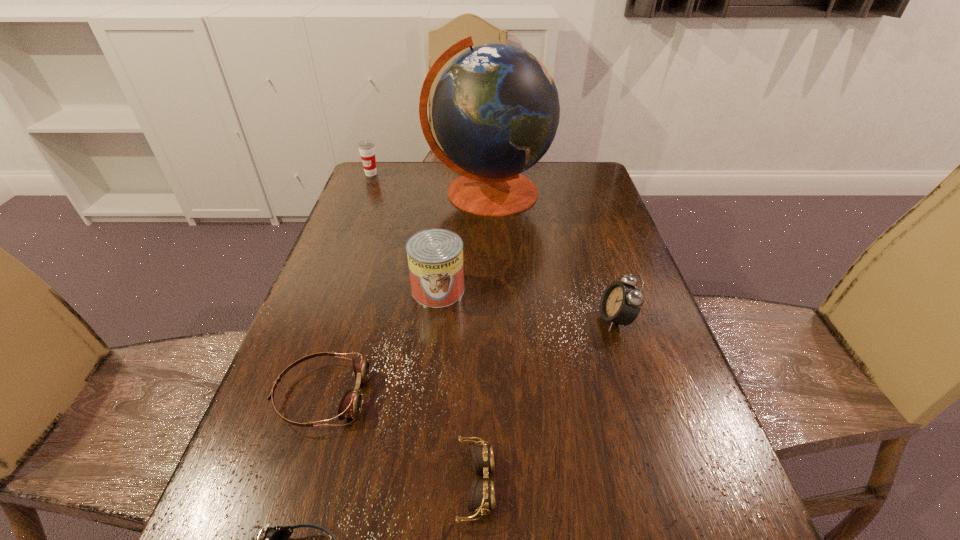
At what (x,y) coordinates should I click in order to perform the action: click on free spot between the fifth farthest object and the can. Please return your answer as a coordinate pair (x, y). Looking at the image, I should click on (380, 343).

Locate an element on the screen. empty space between the fifth farthest object and the rightmost goggles is located at coordinates (399, 440).

Find the location of `free space between the farthest goggles and the tallest object`. free space between the farthest goggles and the tallest object is located at coordinates (405, 294).

Select which object is the closest to the rightmost goggles. Please provide its 2D coordinates. Your answer should be formatted as a tuple, i.e. [(x, y)], where the tuple contains the x and y coordinates of a point satisfying the conditions above.

[(269, 539)]

Locate an element on the screen. the sixth closest object to the alarm clock is located at coordinates (366, 148).

Where is `goggles that is the closest to the alarm clock`? goggles that is the closest to the alarm clock is located at coordinates (482, 493).

Identify which goggles is located as the third nearest to the tallest object. Please provide its 2D coordinates. Your answer should be formatted as a tuple, i.e. [(x, y)], where the tuple contains the x and y coordinates of a point satisfying the conditions above.

[(269, 539)]

The width and height of the screenshot is (960, 540). Find the location of `vacant point that satisfies the following two spatial constraints: 1. on the side of the cup with the logo; 2. on the right side of the can`. vacant point that satisfies the following two spatial constraints: 1. on the side of the cup with the logo; 2. on the right side of the can is located at coordinates (326, 290).

I want to click on free location that satisfies the following two spatial constraints: 1. on the side of the can with the logo; 2. on the right side of the cup, so click(326, 290).